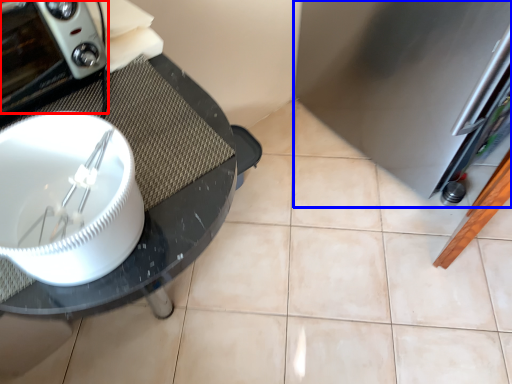
Question: Which of the following is the farthest to the observer, home appliance (highlighted by a red box) or appliance (highlighted by a blue box)?

Choices:
 (A) home appliance
 (B) appliance

Answer: (B)